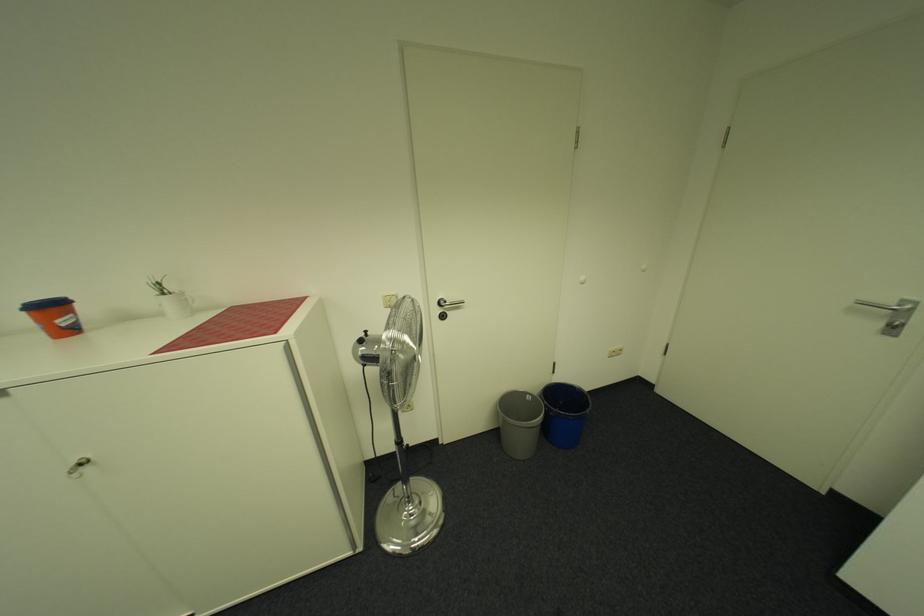
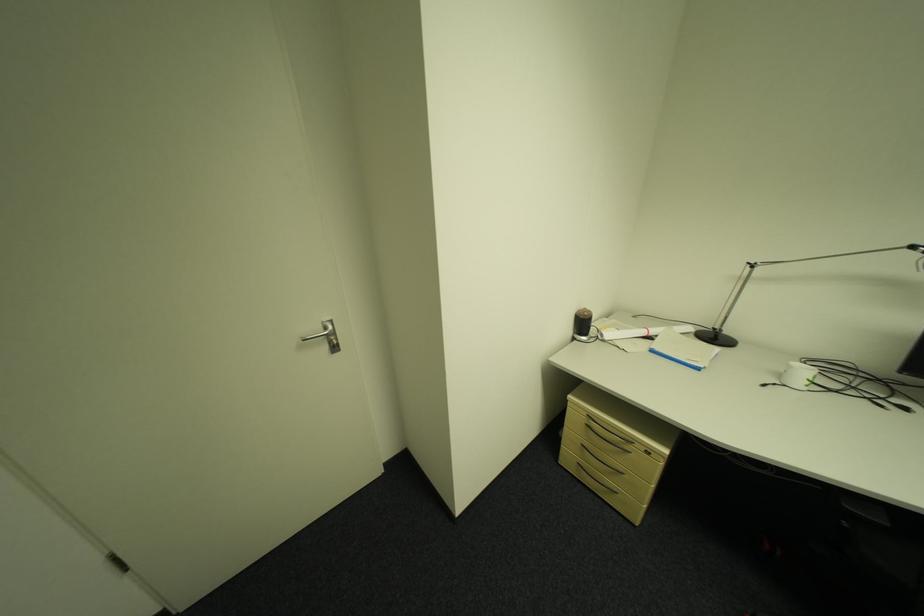
Where in the second image is the point corresponding to (891,325) from the first image?

(335, 349)